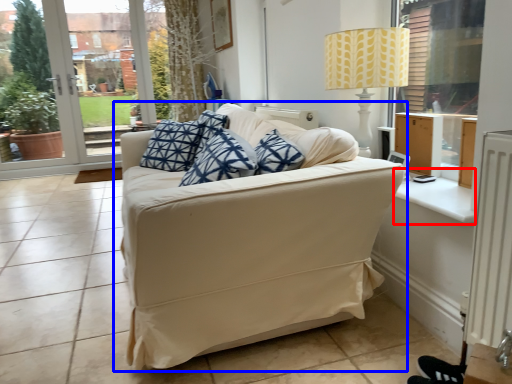
Question: Which point is further to the camera, window sill (highlighted by a red box) or studio couch (highlighted by a blue box)?

Choices:
 (A) window sill
 (B) studio couch

Answer: (A)